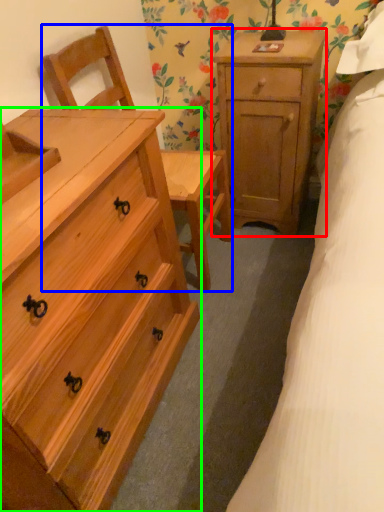
Question: Which object is positioned farthest from nightstand (highlighted by a red box)? Select from armchair (highlighted by a blue box) and chest of drawers (highlighted by a green box).

Choices:
 (A) armchair
 (B) chest of drawers

Answer: (B)